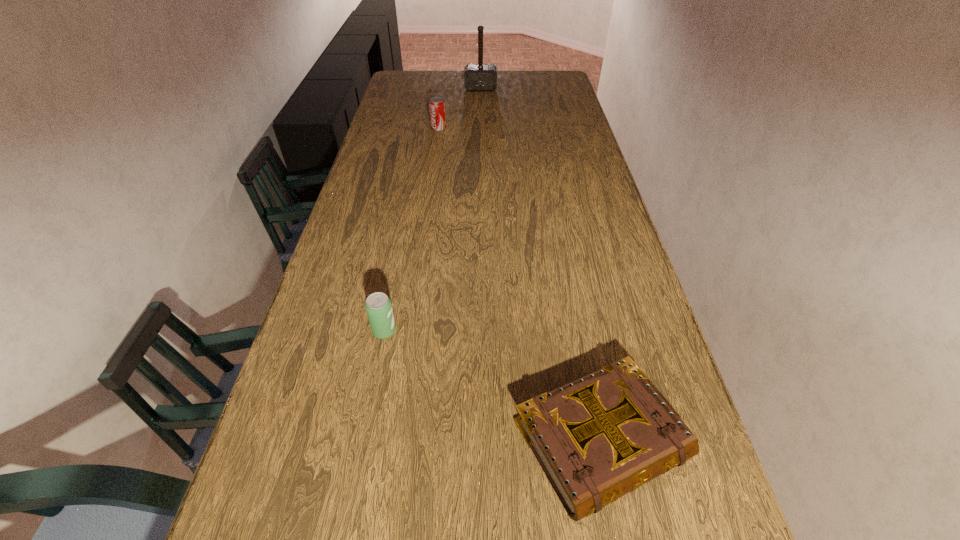
The width and height of the screenshot is (960, 540). I want to click on hammer, so click(477, 77).

I want to click on the tallest object, so click(x=477, y=77).

Locate an element on the screen. The height and width of the screenshot is (540, 960). the right soda is located at coordinates (436, 105).

At what (x,y) coordinates should I click in order to perform the action: click on the farther soda. Please return your answer as a coordinate pair (x, y). Looking at the image, I should click on (436, 105).

Image resolution: width=960 pixels, height=540 pixels. Identify the location of the left soda. (378, 305).

Where is `the leftmost object`? The width and height of the screenshot is (960, 540). the leftmost object is located at coordinates (378, 305).

The image size is (960, 540). I want to click on hardback book, so click(597, 438).

Find the location of `the shortest object`. the shortest object is located at coordinates (597, 438).

At what (x,y) coordinates should I click in order to perform the action: click on vacant space located 0.260m on the left of the tallest object. Please return your answer as a coordinate pair (x, y). The image size is (960, 540). Looking at the image, I should click on (409, 89).

The height and width of the screenshot is (540, 960). I want to click on vacant region located on the logo side of the second object from left to right, so click(x=498, y=129).